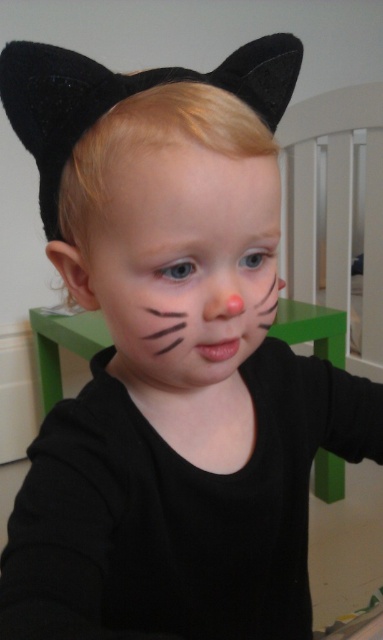
Between point (176, 298) and point (222, 310), which one is positioned in front?

Point (176, 298) is in front.

Does matte black face at center appear on the left side of pink matte nose at center?

Correct, you'll find matte black face at center to the left of pink matte nose at center.

The height and width of the screenshot is (640, 383). Identify the location of matte black face at center. (184, 262).

In the scene shown: Is smooth skin at center smaller than pink matte nose at center?

Incorrect, smooth skin at center is not smaller in size than pink matte nose at center.

Who is positioned more to the left, smooth skin at center or pink matte nose at center?

smooth skin at center is more to the left.

Where is `smooth skin at center`? This screenshot has width=383, height=640. smooth skin at center is located at coordinates pos(188,184).

Can you confirm if matte black face at center is positioned below smooth skin at center?

Indeed, matte black face at center is positioned under smooth skin at center.

Is matte black face at center thinner than smooth skin at center?

In fact, matte black face at center might be wider than smooth skin at center.

In order to click on matte black face at center in this screenshot , I will do `click(184, 262)`.